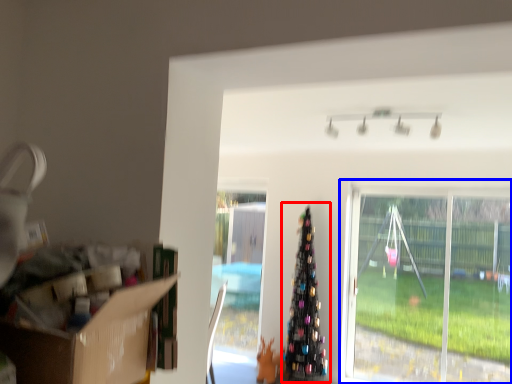
Question: Among these objects, which one is farthest to the camera, christmas tree (highlighted by a red box) or window (highlighted by a blue box)?

Choices:
 (A) christmas tree
 (B) window

Answer: (A)